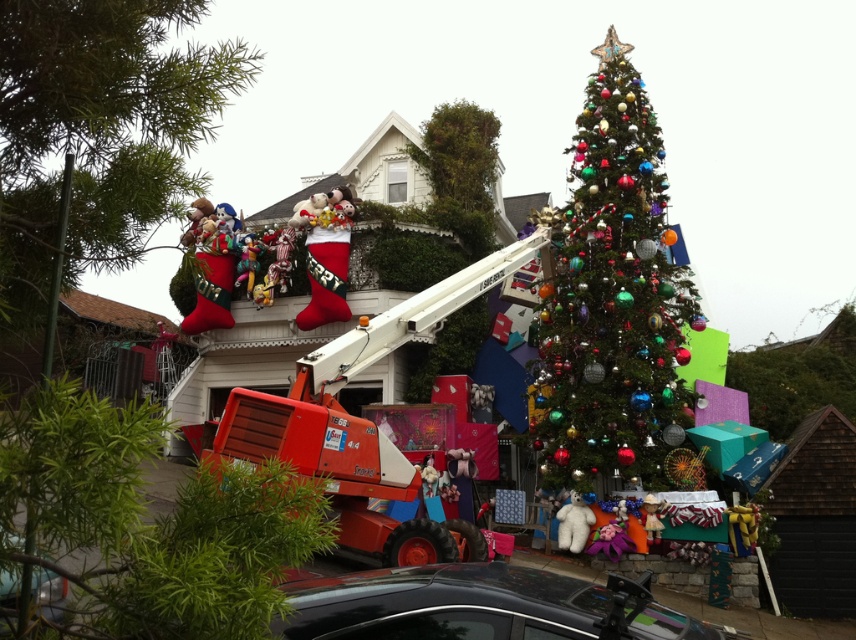
Question: Based on their relative distances, which object is nearer to the green matte tree at upper center?

Choices:
 (A) shiny black car at lower center
 (B) green textured christmas tree at center
 (C) white plush bear at center
 (D) velvet plush santa at center

Answer: (B)

Question: Which point appears closest to the camera in this image?

Choices:
 (A) (9, 241)
 (B) (311, 252)
 (C) (238, 250)

Answer: (A)

Question: Which point appears closest to the camera in this image?

Choices:
 (A) (753, 406)
 (B) (64, 244)
 (C) (592, 518)

Answer: (B)

Question: Does shiny metallic tree at center have a lesser width compared to green matte tree at upper center?

Choices:
 (A) yes
 (B) no

Answer: (A)

Question: Can you confirm if shiny metallic tree at center is bigger than white plush bear at center?

Choices:
 (A) yes
 (B) no

Answer: (B)

Question: In this image, where is green textured christmas tree at center located relative to white plush bear at center?

Choices:
 (A) below
 (B) above

Answer: (B)